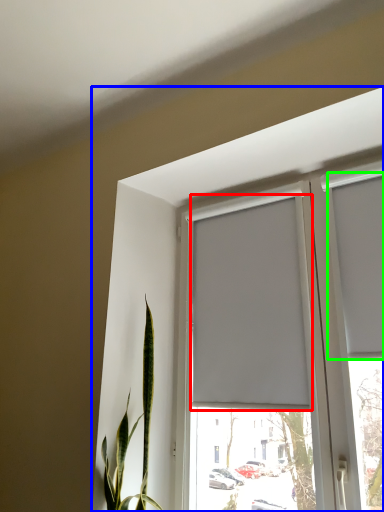
Question: Based on their relative distances, which object is farther from curtain (highlighted by a red box)? Choose from window (highlighted by a blue box) and curtain (highlighted by a green box).

Choices:
 (A) window
 (B) curtain

Answer: (B)